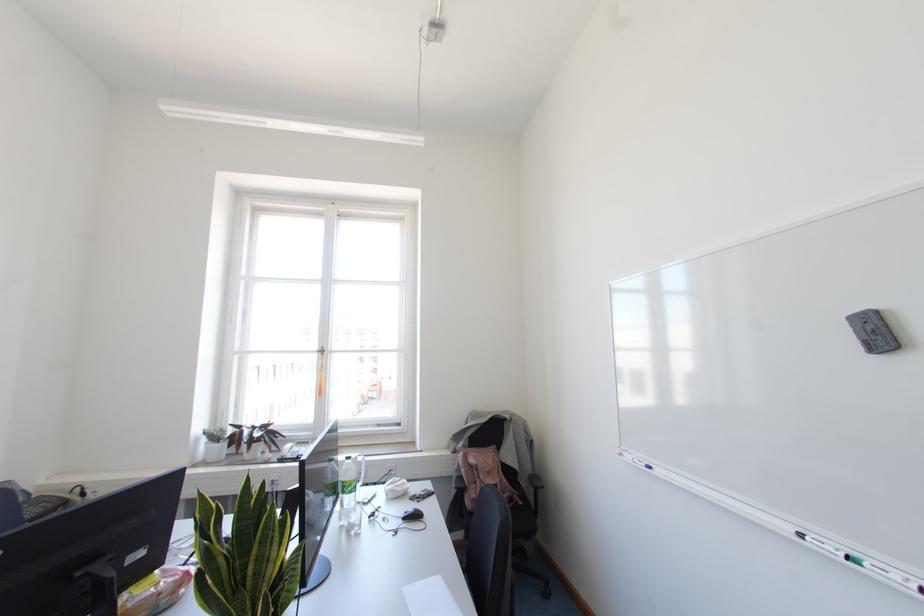
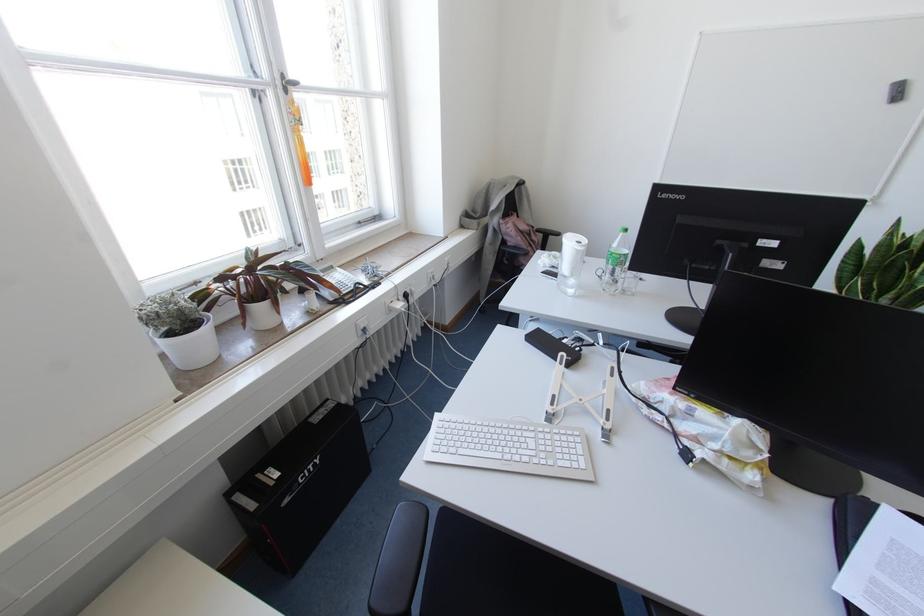
The point at (223, 431) is marked in the first image. Where is the corresponding point in the second image?

(186, 298)